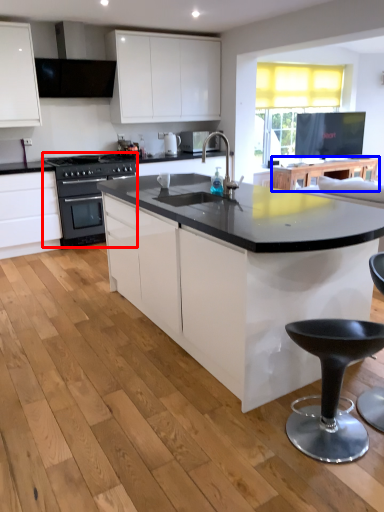
Question: Which object is closer to the camera taking this photo, kitchen appliance (highlighted by a red box) or table (highlighted by a blue box)?

Choices:
 (A) kitchen appliance
 (B) table

Answer: (A)